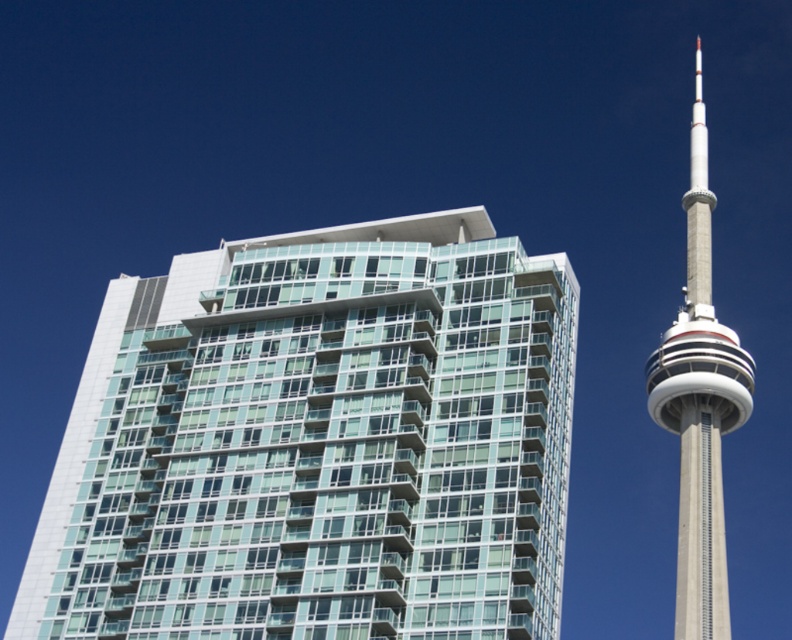
Question: Which point is closer to the camera?

Choices:
 (A) (680, 392)
 (B) (280, 561)

Answer: (B)

Question: Where is glassy teal building at center located in relation to concrete tower at right in the image?

Choices:
 (A) left
 (B) right

Answer: (A)

Question: Can you confirm if glassy teal building at center is positioned below concrete tower at right?

Choices:
 (A) yes
 (B) no

Answer: (B)

Question: Which point is closer to the camera?

Choices:
 (A) (238, 301)
 (B) (706, 378)

Answer: (A)

Question: Is glassy teal building at center bigger than concrete tower at right?

Choices:
 (A) no
 (B) yes

Answer: (A)

Question: Which of the following is the farthest from the observer?

Choices:
 (A) glassy teal building at center
 (B) concrete tower at right

Answer: (B)